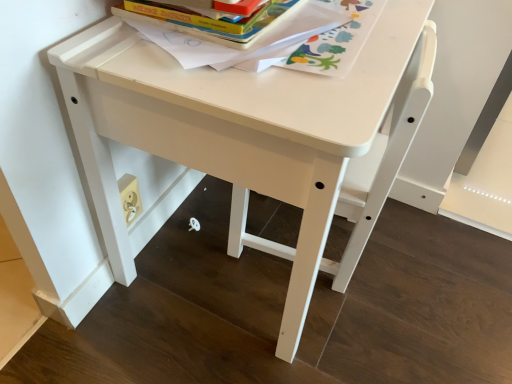
Image resolution: width=512 pixels, height=384 pixels. Identify the location of spots to the right of white matte table at center. (435, 267).